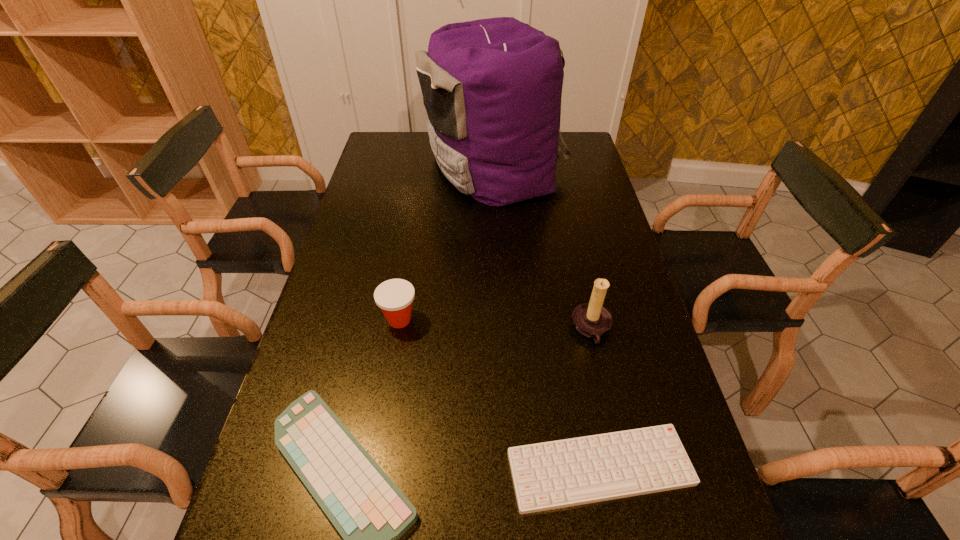
Locate an element on the screen. The width and height of the screenshot is (960, 540). the farthest object is located at coordinates (492, 88).

You are a GUI agent. You are given a task and a screenshot of the screen. Output one action in this format:
    pyautogui.click(x=<x>, y=<y>)
    Task: Click on the tallest object
    
    Given the screenshot: What is the action you would take?
    pyautogui.click(x=492, y=88)

The width and height of the screenshot is (960, 540). I want to click on candle holder, so click(x=591, y=319).

Locate an element on the screen. The image size is (960, 540). Dixie cup is located at coordinates (394, 297).

You are a GUI agent. You are given a task and a screenshot of the screen. Output one action in this format:
    pyautogui.click(x=<x>, y=<y>)
    Task: Click on the right computer keyboard
    
    Given the screenshot: What is the action you would take?
    pos(550,475)

Where is `vacant area situated 0.160m on the front pocket of the backpack`? Image resolution: width=960 pixels, height=540 pixels. vacant area situated 0.160m on the front pocket of the backpack is located at coordinates (380, 167).

What are the coordinates of `blank area located 0.210m on the front pocket of the backpack` in the screenshot? It's located at (367, 167).

At what (x,y) coordinates should I click in order to perform the action: click on free location located on the front pocket of the backpack. Please return your answer as a coordinate pair (x, y). The image size is (960, 540). Looking at the image, I should click on (389, 167).

Where is `vacant space located on the wick of the fourth shortest object`? The height and width of the screenshot is (540, 960). vacant space located on the wick of the fourth shortest object is located at coordinates (501, 330).

Image resolution: width=960 pixels, height=540 pixels. I want to click on vacant space located 0.160m on the wick of the fourth shortest object, so click(x=509, y=330).